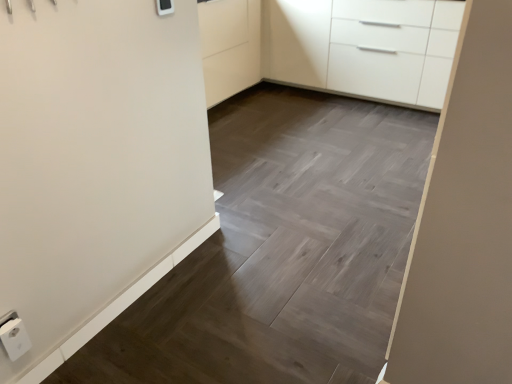
Describe the element at coordinates (14, 337) in the screenshot. I see `white plastic electric outlet at lower left` at that location.

Measure the distance between point (400,72) and camera.

Point (400,72) and camera are 3.47 meters apart from each other.

What do you see at coordinates (364, 46) in the screenshot? I see `white glossy cabinet at upper right` at bounding box center [364, 46].

Locate an element on the screen. white plastic light switch at upper center is located at coordinates (164, 7).

From the image's perspective, is white plastic light switch at upper center above or below white plastic electric outlet at lower left?

Clearly, from the image's perspective, white plastic light switch at upper center is above white plastic electric outlet at lower left.

Does white plastic light switch at upper center appear on the left side of white plastic electric outlet at lower left?

No.

Is white plastic light switch at upper center surrounding white plastic electric outlet at lower left?

No, white plastic electric outlet at lower left is located outside of white plastic light switch at upper center.

Is the surface of white plastic light switch at upper center in direct contact with white plastic electric outlet at lower left?

No, white plastic light switch at upper center is not next to white plastic electric outlet at lower left.

From a real-world perspective, who is located higher, white glossy cabinet at upper right or white plastic electric outlet at lower left?

In real-world perspective, white glossy cabinet at upper right is above.

Where is `electric outlet that is below the white glossy cabinet at upper right (from the image's perspective)`? The image size is (512, 384). electric outlet that is below the white glossy cabinet at upper right (from the image's perspective) is located at coordinates (14, 337).

From their relative heights in the image, would you say white glossy cabinet at upper right is taller or shorter than white plastic electric outlet at lower left?

Considering their sizes, white glossy cabinet at upper right has more height than white plastic electric outlet at lower left.

Considering the positions of objects white glossy cabinet at upper right and white plastic electric outlet at lower left in the image provided, who is in front, white glossy cabinet at upper right or white plastic electric outlet at lower left?

Positioned in front is white plastic electric outlet at lower left.

Looking at this image, is white plastic electric outlet at lower left situated inside white plastic light switch at upper center or outside?

white plastic electric outlet at lower left exists outside the volume of white plastic light switch at upper center.

From a real-world perspective, which is physically above, white plastic electric outlet at lower left or white plastic light switch at upper center?

white plastic light switch at upper center is physically above.

Considering the positions of objects white plastic electric outlet at lower left and white plastic light switch at upper center in the image provided, who is in front, white plastic electric outlet at lower left or white plastic light switch at upper center?

Positioned in front is white plastic electric outlet at lower left.

Is white glossy cabinet at upper right surrounding white plastic light switch at upper center?

Actually, white plastic light switch at upper center is outside white glossy cabinet at upper right.

Is white glossy cabinet at upper right wider than white plastic light switch at upper center?

Indeed, white glossy cabinet at upper right has a greater width compared to white plastic light switch at upper center.

From the image's perspective, is white glossy cabinet at upper right above or below white plastic light switch at upper center?

white glossy cabinet at upper right is above white plastic light switch at upper center.

Consider the image. Considering the sizes of white glossy cabinet at upper right and white plastic light switch at upper center in the image, is white glossy cabinet at upper right taller or shorter than white plastic light switch at upper center?

Clearly, white glossy cabinet at upper right is taller compared to white plastic light switch at upper center.

Measure the distance from white plastic electric outlet at lower left to white glossy cabinet at upper right.

They are 10.50 feet apart.

From a real-world perspective, who is located higher, white plastic electric outlet at lower left or white glossy cabinet at upper right?

In real-world perspective, white glossy cabinet at upper right is above.

Consider the image. Is white plastic electric outlet at lower left directly adjacent to white glossy cabinet at upper right?

white plastic electric outlet at lower left and white glossy cabinet at upper right are clearly separated.

In terms of width, does white plastic electric outlet at lower left look wider or thinner when compared to white glossy cabinet at upper right?

In the image, white plastic electric outlet at lower left appears to be more narrow than white glossy cabinet at upper right.

Which is in front, white plastic light switch at upper center or white glossy cabinet at upper right?

white plastic light switch at upper center.

Can you see white plastic light switch at upper center touching white glossy cabinet at upper right?

No, white plastic light switch at upper center is not with white glossy cabinet at upper right.

From the image's perspective, is white plastic light switch at upper center under white glossy cabinet at upper right?

Indeed, from the image's perspective, white plastic light switch at upper center is shown beneath white glossy cabinet at upper right.

From a real-world perspective, between white plastic light switch at upper center and white glossy cabinet at upper right, who is vertically higher?

white plastic light switch at upper center.

Identify the location of light switch above the white plastic electric outlet at lower left (from the image's perspective). (164, 7).

I want to click on electric outlet below the white glossy cabinet at upper right (from the image's perspective), so click(14, 337).

Based on their spatial positions, is white plastic electric outlet at lower left or white plastic light switch at upper center further from white glossy cabinet at upper right?

Based on the image, white plastic electric outlet at lower left appears to be further to white glossy cabinet at upper right.

Which object lies nearer to the anchor point white glossy cabinet at upper right, white plastic light switch at upper center or white plastic electric outlet at lower left?

white plastic light switch at upper center lies closer to white glossy cabinet at upper right than the other object.

Considering their positions, is white plastic electric outlet at lower left positioned closer to white plastic light switch at upper center than white glossy cabinet at upper right?

white plastic electric outlet at lower left is closer to white plastic light switch at upper center.

Estimate the real-world distances between objects in this image. Which object is further from white plastic electric outlet at lower left, white glossy cabinet at upper right or white plastic light switch at upper center?

white glossy cabinet at upper right.

When comparing their distances from white plastic light switch at upper center, does white glossy cabinet at upper right or white plastic electric outlet at lower left seem further?

Based on the image, white glossy cabinet at upper right appears to be further to white plastic light switch at upper center.

Looking at the image, which one is located further to white plastic electric outlet at lower left, white plastic light switch at upper center or white glossy cabinet at upper right?

Based on the image, white glossy cabinet at upper right appears to be further to white plastic electric outlet at lower left.

The height and width of the screenshot is (384, 512). In order to click on light switch between white glossy cabinet at upper right and white plastic electric outlet at lower left in the up-down direction in this screenshot , I will do `click(164, 7)`.